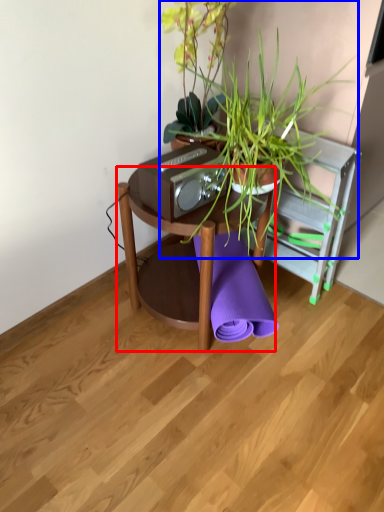
Question: Which point is closer to the camera, table (highlighted by a red box) or houseplant (highlighted by a blue box)?

Choices:
 (A) table
 (B) houseplant

Answer: (B)